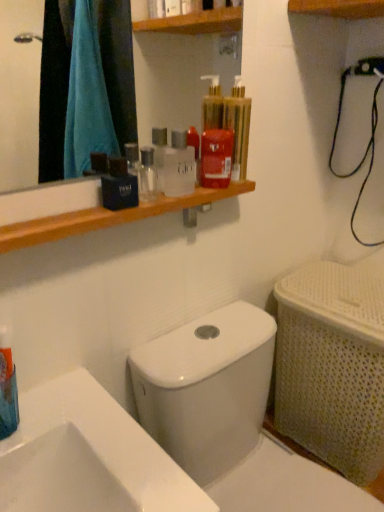
The height and width of the screenshot is (512, 384). I want to click on empty space that is ontop of wooden shelf at upper center (from a real-world perspective), so [x=128, y=201].